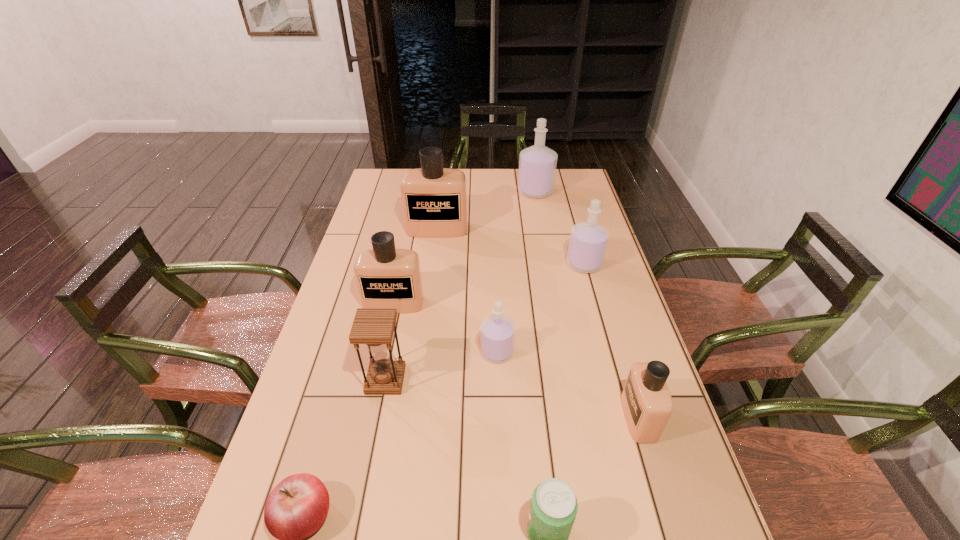
You are a GUI agent. You are given a task and a screenshot of the screen. Output one action in this format:
    pyautogui.click(x=<x>, y=<y>)
    Task: Click on the farthest purple perfume
    Image resolution: width=960 pixels, height=540 pixels.
    Given the screenshot: What is the action you would take?
    pos(537,164)

Identify the location of the farthest object. The height and width of the screenshot is (540, 960). (537, 164).

The height and width of the screenshot is (540, 960). Identify the location of the second farthest object. (434, 201).

Locate an element on the screen. The height and width of the screenshot is (540, 960). the farthest beige perfume is located at coordinates (434, 201).

Where is `the second nearest purple perfume`? the second nearest purple perfume is located at coordinates (588, 241).

Find the location of a particular element. the fourth nearest perfume is located at coordinates (588, 241).

Find the location of a particular element. The height and width of the screenshot is (540, 960). the third nearest perfume is located at coordinates (386, 277).

Where is `the fourth farthest object`? the fourth farthest object is located at coordinates (386, 277).

At what (x,y) coordinates should I click in order to perform the action: click on hourglass. Please return your answer as a coordinate pair (x, y). This screenshot has height=540, width=960. Looking at the image, I should click on (374, 327).

At what (x,y) coordinates should I click in order to perform the action: click on the nearest purple perfume. Please return your answer as a coordinate pair (x, y). Image resolution: width=960 pixels, height=540 pixels. Looking at the image, I should click on (497, 331).